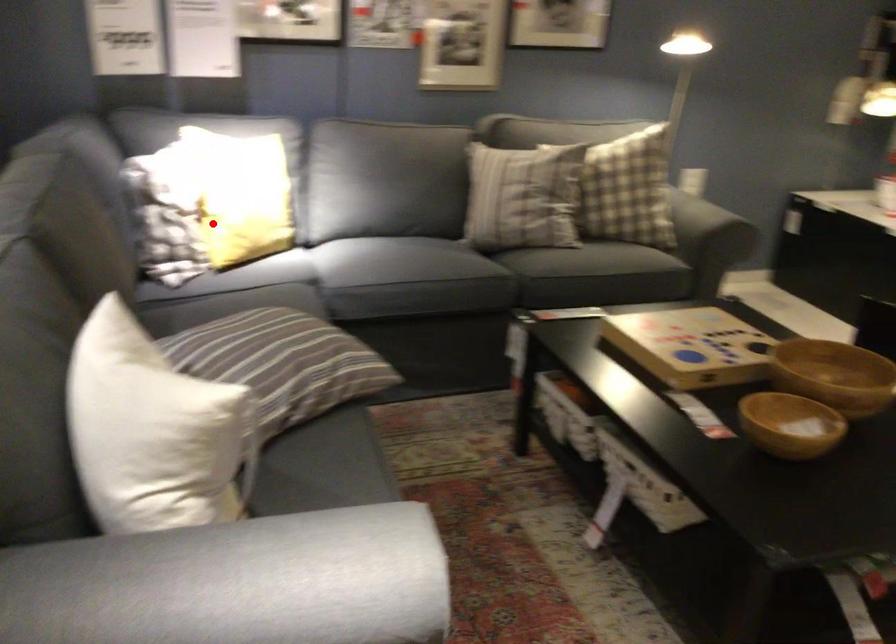
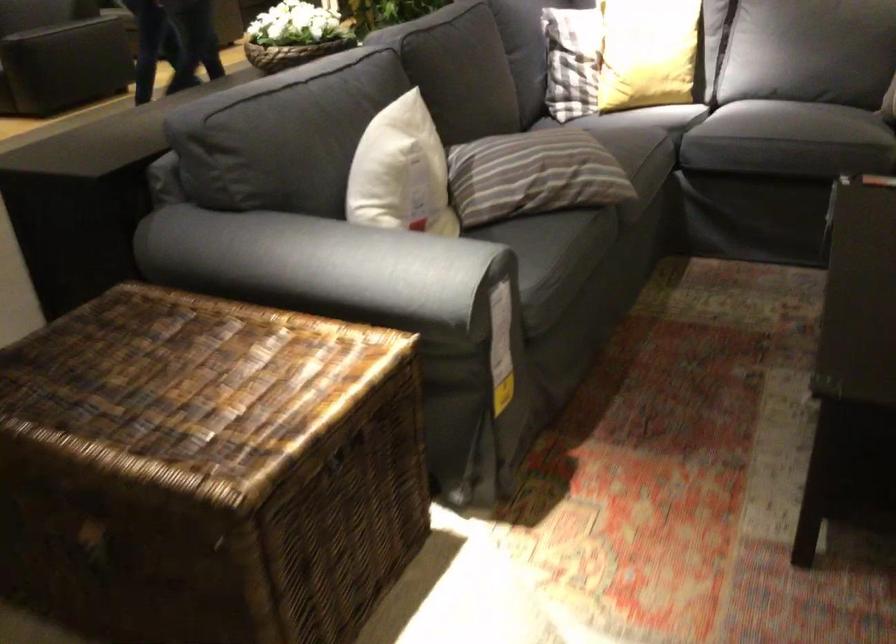
In the second image, find the point that corresponds to the highlighted location in the first image.

(572, 61)